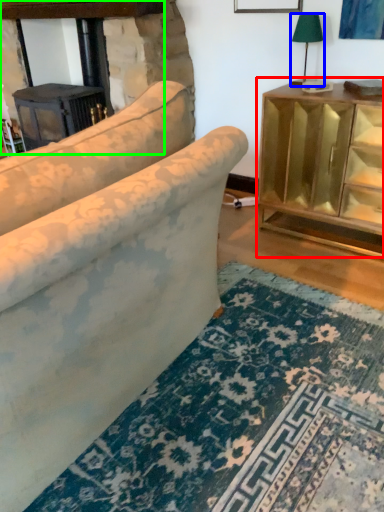
Question: Which is farther away from table (highlighted by a red box)? table lamp (highlighted by a blue box) or fireplace (highlighted by a green box)?

Choices:
 (A) table lamp
 (B) fireplace

Answer: (B)